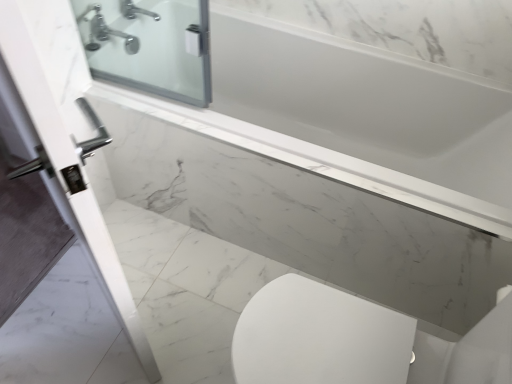
Question: Does white marble ledge at upper center have a greater height compared to silver metallic faucet at upper left?

Choices:
 (A) no
 (B) yes

Answer: (B)

Question: Is white marble ledge at upper center aimed at silver metallic faucet at upper left?

Choices:
 (A) no
 (B) yes

Answer: (A)

Question: Is white marble ledge at upper center with silver metallic faucet at upper left?

Choices:
 (A) no
 (B) yes

Answer: (A)

Question: From the image's perspective, is white marble ledge at upper center beneath silver metallic faucet at upper left?

Choices:
 (A) no
 (B) yes

Answer: (B)

Question: Is white marble ledge at upper center shorter than silver metallic faucet at upper left?

Choices:
 (A) yes
 (B) no

Answer: (B)

Question: Is white marble ledge at upper center thinner than silver metallic faucet at upper left?

Choices:
 (A) yes
 (B) no

Answer: (A)

Question: Is silver metallic faucet at upper left outside white glossy door handle at left?

Choices:
 (A) yes
 (B) no

Answer: (A)

Question: Is silver metallic faucet at upper left directly adjacent to white glossy door handle at left?

Choices:
 (A) yes
 (B) no

Answer: (B)

Question: Is silver metallic faucet at upper left surrounding white glossy door handle at left?

Choices:
 (A) yes
 (B) no

Answer: (B)

Question: From the image's perspective, would you say silver metallic faucet at upper left is positioned over white glossy door handle at left?

Choices:
 (A) yes
 (B) no

Answer: (A)

Question: From a real-world perspective, is silver metallic faucet at upper left physically below white glossy door handle at left?

Choices:
 (A) yes
 (B) no

Answer: (B)

Question: From the image's perspective, is silver metallic faucet at upper left below white glossy door handle at left?

Choices:
 (A) no
 (B) yes

Answer: (A)

Question: Can you see white glossy door handle at left touching silver metallic faucet at upper left?

Choices:
 (A) no
 (B) yes

Answer: (A)